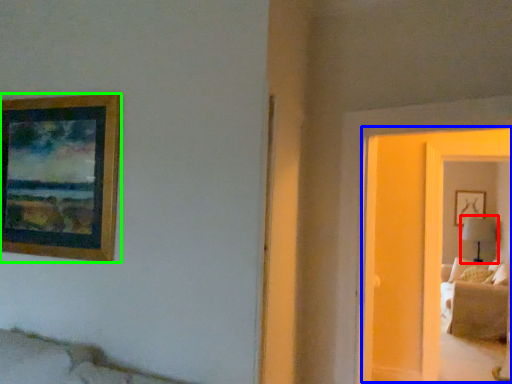
Question: Which object is positioned closest to table lamp (highlighted by a red box)? Select from glass door (highlighted by a blue box) and picture frame (highlighted by a green box).

Choices:
 (A) glass door
 (B) picture frame

Answer: (A)